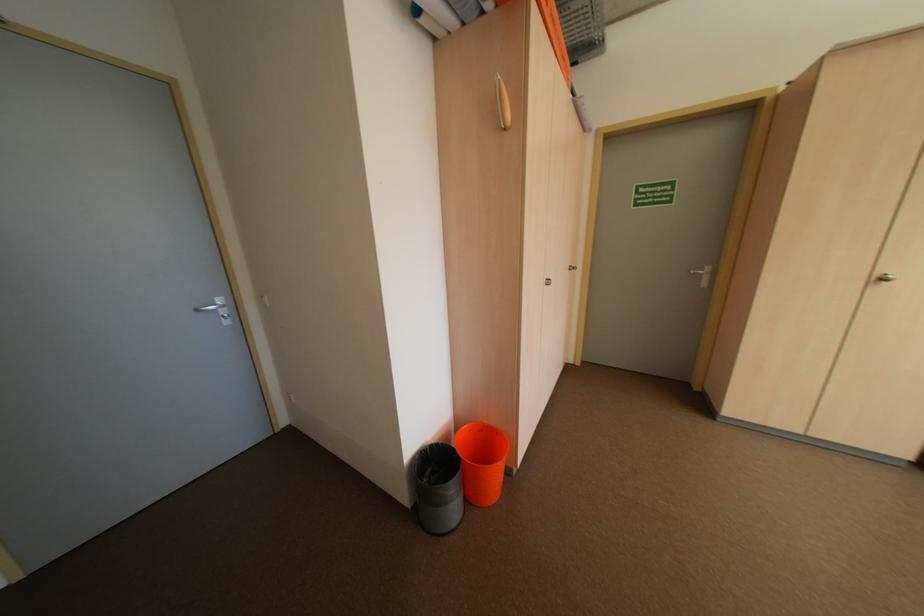
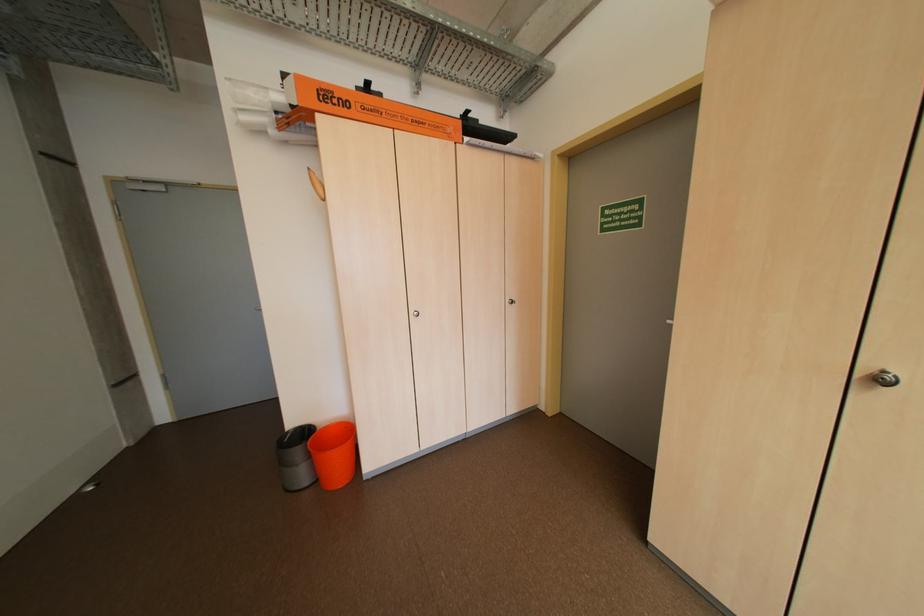
Where in the second image is the point corresponding to (893,281) from the first image?

(891, 381)